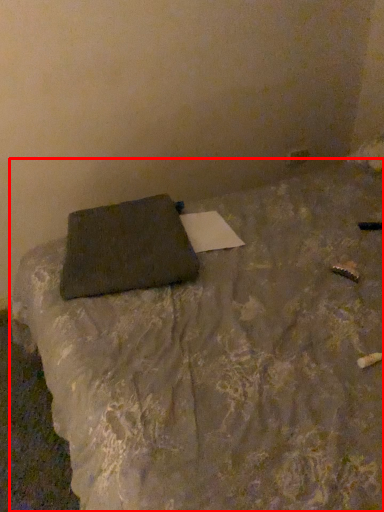
Question: From the image's perspective, what is the correct spatial relationship of furniture (annotated by the red box) in relation to pillow?

Choices:
 (A) below
 (B) above

Answer: (A)